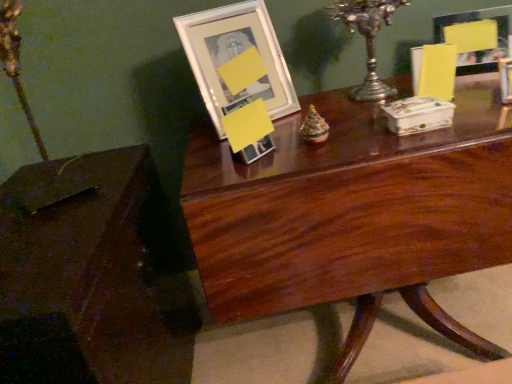
Question: Can you confirm if brown polished wood table at lower left, the 2th table viewed from the right, is positioned to the right of silver metallic candle holder at upper center?

Choices:
 (A) no
 (B) yes

Answer: (A)

Question: From a real-world perspective, is brown polished wood table at lower left, the 2th table viewed from the right, on silver metallic candle holder at upper center?

Choices:
 (A) yes
 (B) no

Answer: (B)

Question: Can you confirm if brown polished wood table at lower left, the 1th table viewed from the left, is wider than silver metallic candle holder at upper center?

Choices:
 (A) no
 (B) yes

Answer: (B)

Question: From the image's perspective, is brown polished wood table at lower left, the 1th table viewed from the left, beneath silver metallic candle holder at upper center?

Choices:
 (A) no
 (B) yes

Answer: (B)

Question: Is brown polished wood table at lower left, the 1th table viewed from the left, taller than silver metallic candle holder at upper center?

Choices:
 (A) no
 (B) yes

Answer: (B)

Question: In terms of size, does brown polished wood table at lower left, the 1th table viewed from the left, appear bigger or smaller than matte glass picture frame at upper right, acting as the 1th picture frame starting from the right?

Choices:
 (A) small
 (B) big

Answer: (B)

Question: From a real-world perspective, relative to matte glass picture frame at upper right, acting as the 1th picture frame starting from the right, is brown polished wood table at lower left, the 1th table viewed from the left, vertically above or below?

Choices:
 (A) above
 (B) below

Answer: (B)

Question: Considering the positions of brown polished wood table at lower left, the 2th table viewed from the right, and matte glass picture frame at upper right, acting as the 1th picture frame starting from the right, in the image, is brown polished wood table at lower left, the 2th table viewed from the right, wider or thinner than matte glass picture frame at upper right, acting as the 1th picture frame starting from the right,?

Choices:
 (A) wide
 (B) thin

Answer: (A)

Question: Is brown polished wood table at lower left, the 2th table viewed from the right, spatially inside matte glass picture frame at upper right, acting as the 1th picture frame starting from the right, or outside of it?

Choices:
 (A) outside
 (B) inside

Answer: (A)

Question: Looking at the image, does brown polished wood table at lower left, the 2th table viewed from the right, seem bigger or smaller compared to silver metallic candle holder at upper center?

Choices:
 (A) small
 (B) big

Answer: (B)

Question: Is brown polished wood table at lower left, the 1th table viewed from the left, in front of or behind silver metallic candle holder at upper center in the image?

Choices:
 (A) behind
 (B) front

Answer: (B)

Question: From a real-world perspective, relative to silver metallic candle holder at upper center, is brown polished wood table at lower left, the 2th table viewed from the right, vertically above or below?

Choices:
 (A) above
 (B) below

Answer: (B)

Question: Is brown polished wood table at lower left, the 1th table viewed from the left, to the left or to the right of silver metallic candle holder at upper center in the image?

Choices:
 (A) right
 (B) left

Answer: (B)

Question: Considering the positions of matte glass picture frame at upper right, acting as the 1th picture frame starting from the right, and mahogany wood table at center, which is the second table in left-to-right order, in the image, is matte glass picture frame at upper right, acting as the 1th picture frame starting from the right, taller or shorter than mahogany wood table at center, which is the second table in left-to-right order,?

Choices:
 (A) short
 (B) tall

Answer: (A)

Question: Is matte glass picture frame at upper right, which is counted as the 2th picture frame, starting from the left, in front of or behind mahogany wood table at center, which is the second table in left-to-right order, in the image?

Choices:
 (A) behind
 (B) front

Answer: (A)